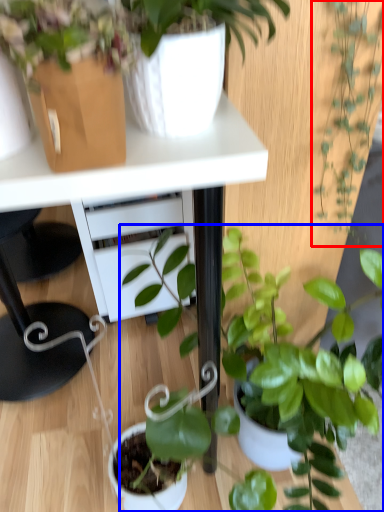
Question: Among these objects, which one is nearest to the camera, houseplant (highlighted by a red box) or houseplant (highlighted by a blue box)?

Choices:
 (A) houseplant
 (B) houseplant

Answer: (B)